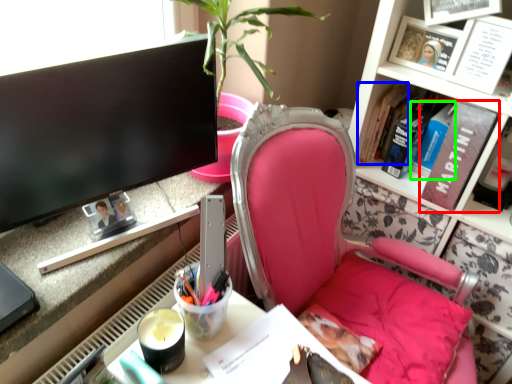
Question: Which object is the farthest from book (highlighted by a red box)? Choose among these: book (highlighted by a blue box) or book (highlighted by a green box).

Choices:
 (A) book
 (B) book

Answer: (A)